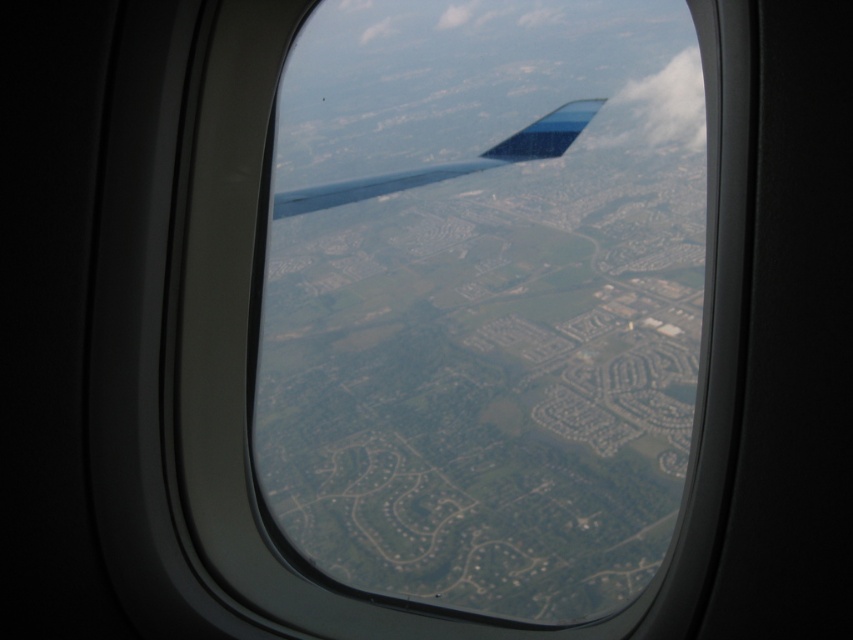
Question: Is transparent glass window at center to the right of white fluffy cloud at upper right from the viewer's perspective?

Choices:
 (A) yes
 (B) no

Answer: (B)

Question: Where is transparent glass window at center located in relation to white fluffy cloud at upper right in the image?

Choices:
 (A) above
 (B) below

Answer: (B)

Question: Considering the real-world distances, which object is farthest from the metallic blue wing at center?

Choices:
 (A) transparent glass window at center
 (B) white fluffy cloud at upper right

Answer: (B)

Question: Is transparent glass window at center further to camera compared to white fluffy cloud at upper right?

Choices:
 (A) no
 (B) yes

Answer: (A)

Question: Based on their relative distances, which object is farther from the white fluffy cloud at upper right?

Choices:
 (A) transparent glass window at center
 (B) metallic blue wing at center

Answer: (A)

Question: Which is farther from the transparent glass window at center?

Choices:
 (A) metallic blue wing at center
 (B) white fluffy cloud at upper right

Answer: (B)